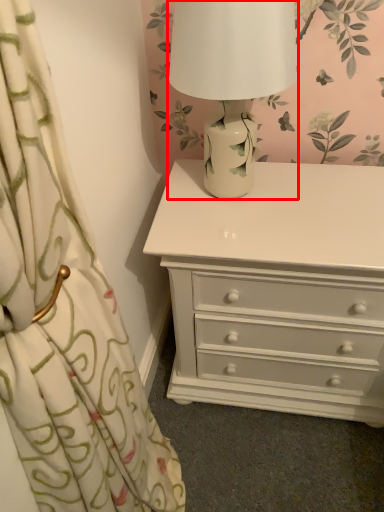
Question: From the image's perspective, where is table lamp (annotated by the red box) located in relation to chest of drawers in the image?

Choices:
 (A) below
 (B) above

Answer: (B)